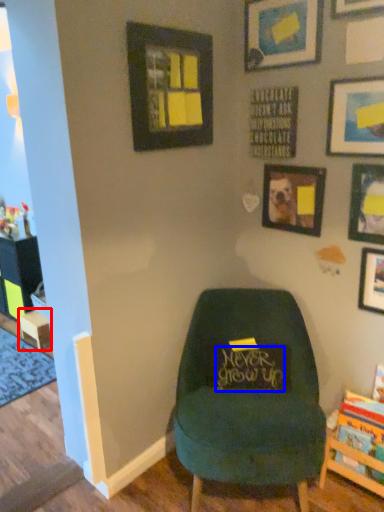
Question: Which of the following is the closest to the observer, table (highlighted by a red box) or writing (highlighted by a blue box)?

Choices:
 (A) table
 (B) writing

Answer: (B)